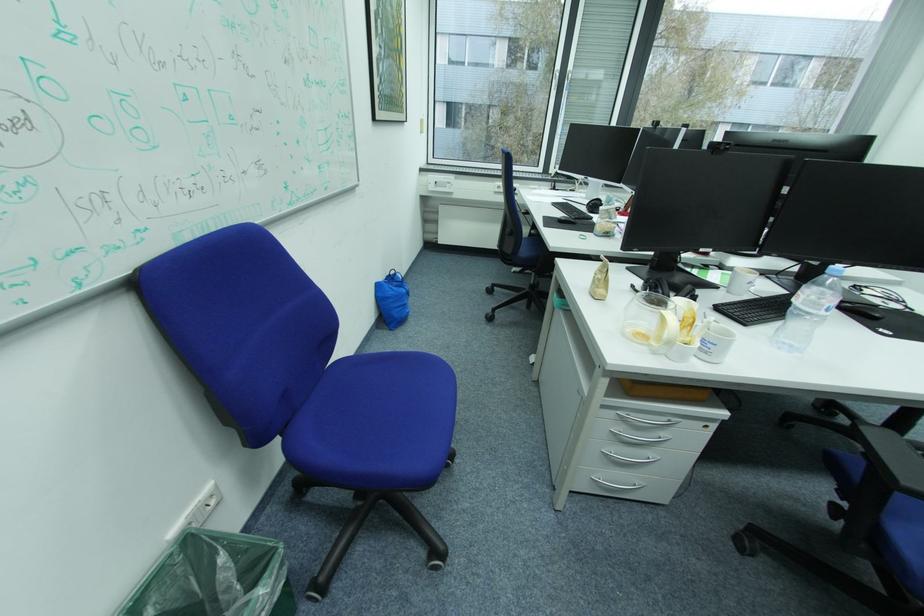
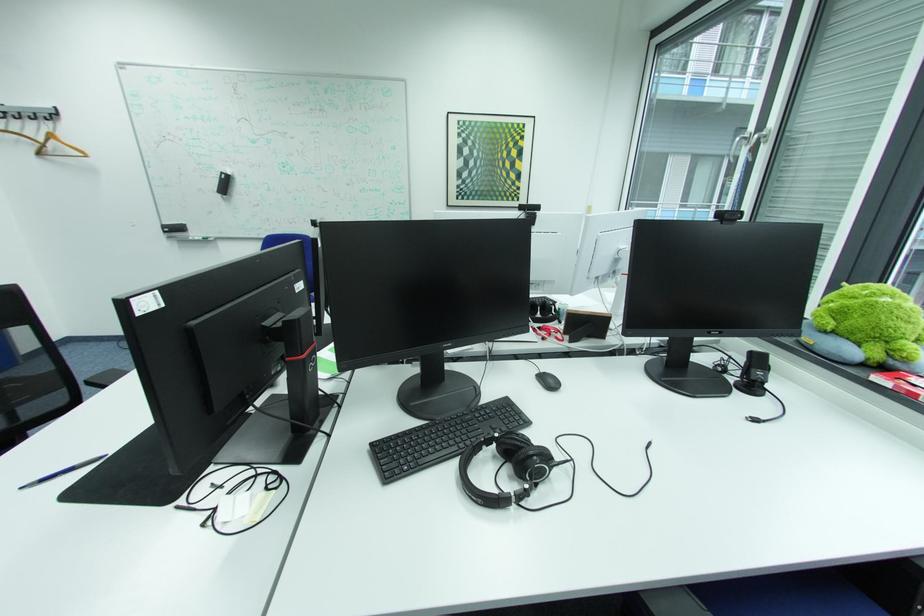
Locate, in the second image, the point that corresponds to (339,95) in the first image.

(393, 195)